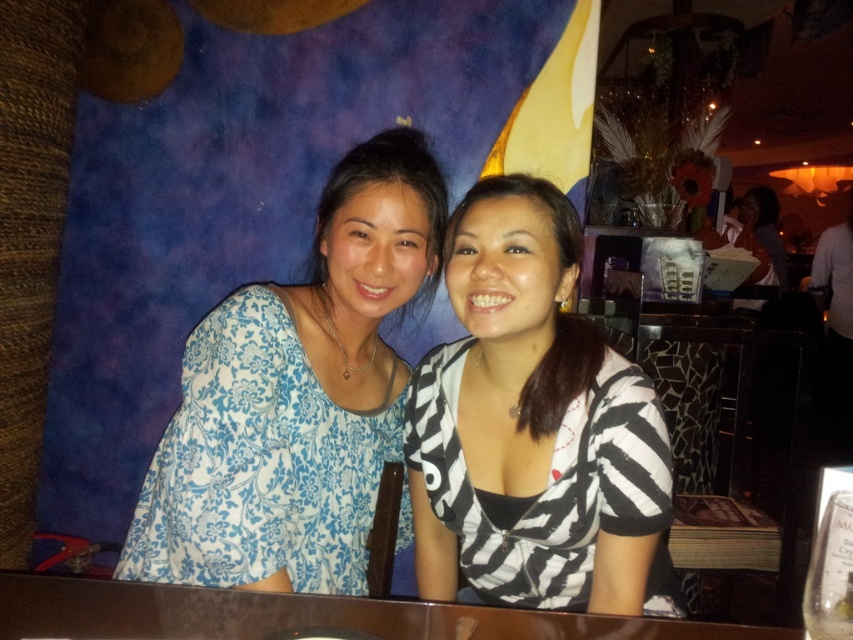
You are a photographer setting up a shot of the scene. You want to ensure the blue floral blouse at center and the brown wooden table at center are both in focus. Which object should you position closer to the camera to achieve this?

The brown wooden table at center is behind the blue floral blouse at center, so to have both in focus, you should position the camera closer to the blue floral blouse at center since it is in front.

In the scene shown: You are a photographer trying to capture a candid shot of the zebra print blouse at center and the brown wooden table at center. Since you want to focus on the blouse, which object should you position closer to the camera?

You should position the zebra print blouse at center closer to the camera because it is in front of the brown wooden table at center, making it naturally closer to the viewer.

In the scene shown: You are standing in the restaurant and want to point to the exact location of the point at coordinates (296, 396). Which object should you point to?

The point at coordinates (296, 396) is located on the blue floral blouse at center, so you should point to the blue floral blouse at center.